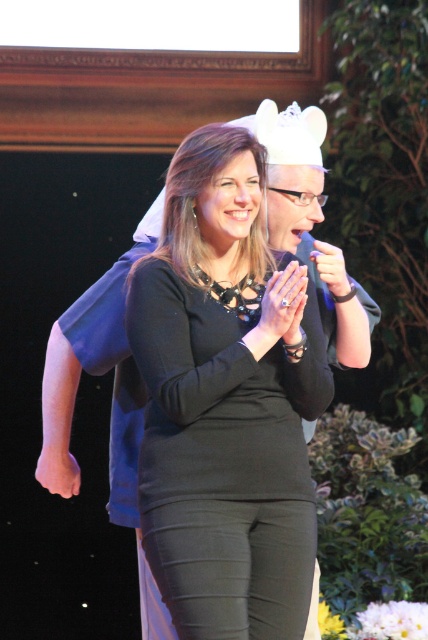
You are a photographer standing behind the stage. You need to capture a closeup shot of the black matte dress at center and the smooth skin hand at center in the same frame. The camera you are using has a minimum focusing distance of 20 inches. Can you take the photo without moving either object?

The black matte dress at center is 21.37 inches away from the smooth skin hand at center. Since the camera requires a minimum focusing distance of 20 inches, the distance between them is sufficient to capture both in focus without moving anything.